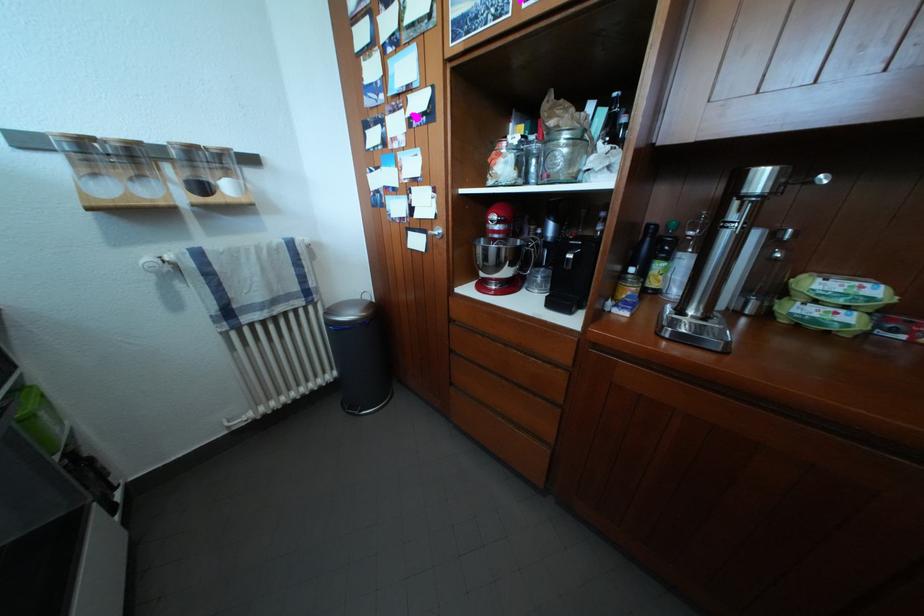
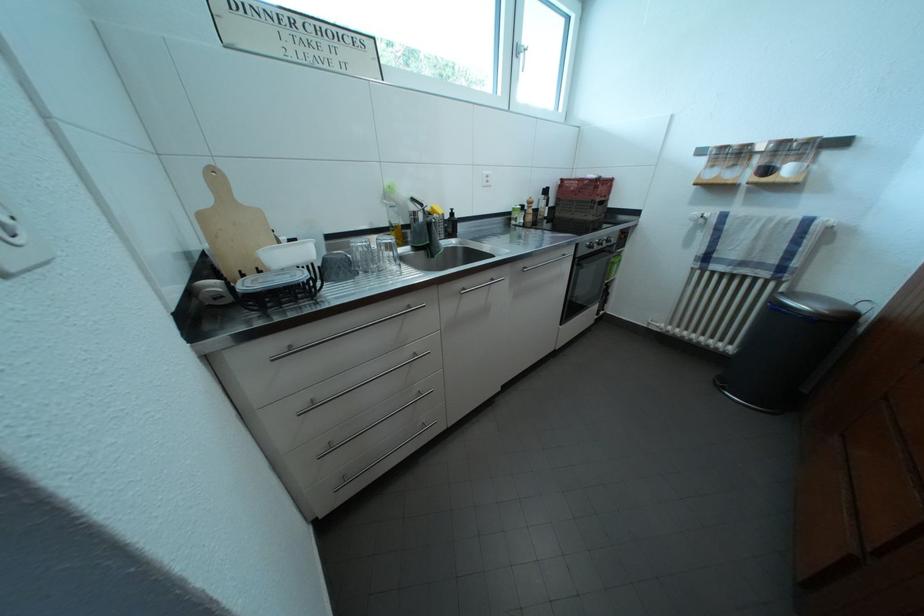
Find the pixel in the second image that matches [338,317] in the first image.

(797, 301)